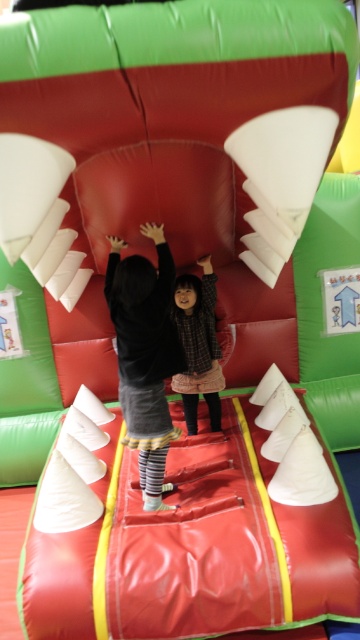
Image resolution: width=360 pixels, height=640 pixels. Describe the element at coordinates (145, 353) in the screenshot. I see `black fleece jacket at center` at that location.

Does point (163, 378) lie in front of point (187, 384)?

Yes.

Is point (156, 461) closer to camera compared to point (191, 378)?

Yes.

At what (x,y) coordinates should I click in order to perform the action: click on black fleece jacket at center. Please return your answer as a coordinate pair (x, y). This screenshot has height=640, width=360. Looking at the image, I should click on (145, 353).